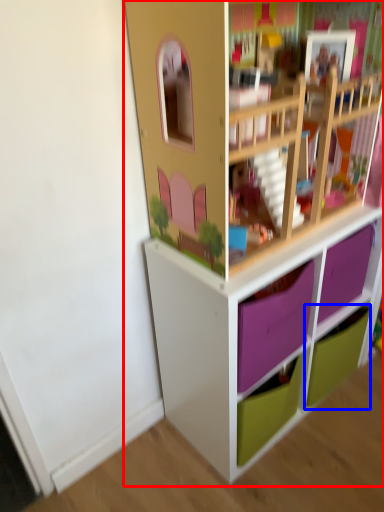
Question: Which point is further to the camera, shelf (highlighted by a red box) or drawer (highlighted by a blue box)?

Choices:
 (A) shelf
 (B) drawer

Answer: (B)